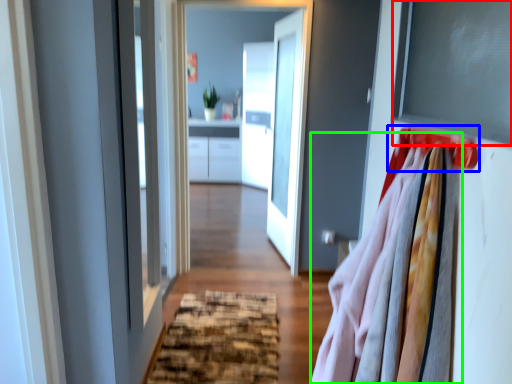
Question: Estimate the real-world distances between objects in this image. Which object is closer to window screen (highlighted by a red box), hanger (highlighted by a blue box) or clothing (highlighted by a green box)?

Choices:
 (A) hanger
 (B) clothing

Answer: (A)